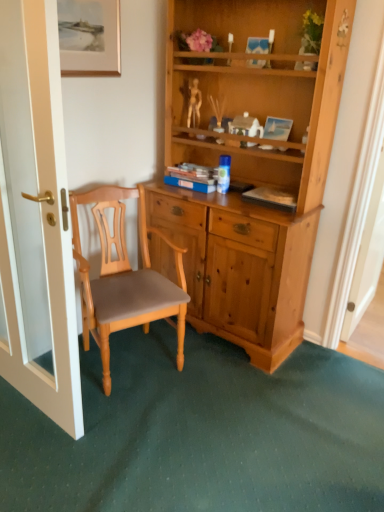
Question: Can you confirm if gold-framed painting at upper left is thinner than blue matte book at center?

Choices:
 (A) yes
 (B) no

Answer: (A)

Question: Can you confirm if gold-framed painting at upper left is taller than blue matte book at center?

Choices:
 (A) no
 (B) yes

Answer: (B)

Question: Is gold-framed painting at upper left positioned far away from blue matte book at center?

Choices:
 (A) yes
 (B) no

Answer: (B)

Question: Can you confirm if gold-framed painting at upper left is bigger than blue matte book at center?

Choices:
 (A) yes
 (B) no

Answer: (B)

Question: From the image's perspective, is gold-framed painting at upper left beneath blue matte book at center?

Choices:
 (A) no
 (B) yes

Answer: (A)

Question: Does gold-framed painting at upper left come behind blue matte book at center?

Choices:
 (A) yes
 (B) no

Answer: (B)

Question: Is blue glossy coffee cup at center wider than gold-framed painting at upper left?

Choices:
 (A) yes
 (B) no

Answer: (A)

Question: Is blue glossy coffee cup at center not inside gold-framed painting at upper left?

Choices:
 (A) yes
 (B) no

Answer: (A)

Question: Could you tell me if blue glossy coffee cup at center is facing gold-framed painting at upper left?

Choices:
 (A) no
 (B) yes

Answer: (A)

Question: Can you confirm if blue glossy coffee cup at center is bigger than gold-framed painting at upper left?

Choices:
 (A) yes
 (B) no

Answer: (B)

Question: Does blue glossy coffee cup at center lie in front of gold-framed painting at upper left?

Choices:
 (A) yes
 (B) no

Answer: (B)

Question: Is blue glossy coffee cup at center smaller than gold-framed painting at upper left?

Choices:
 (A) yes
 (B) no

Answer: (A)

Question: Is blue matte book at center bigger than gold-framed painting at upper left?

Choices:
 (A) no
 (B) yes

Answer: (B)